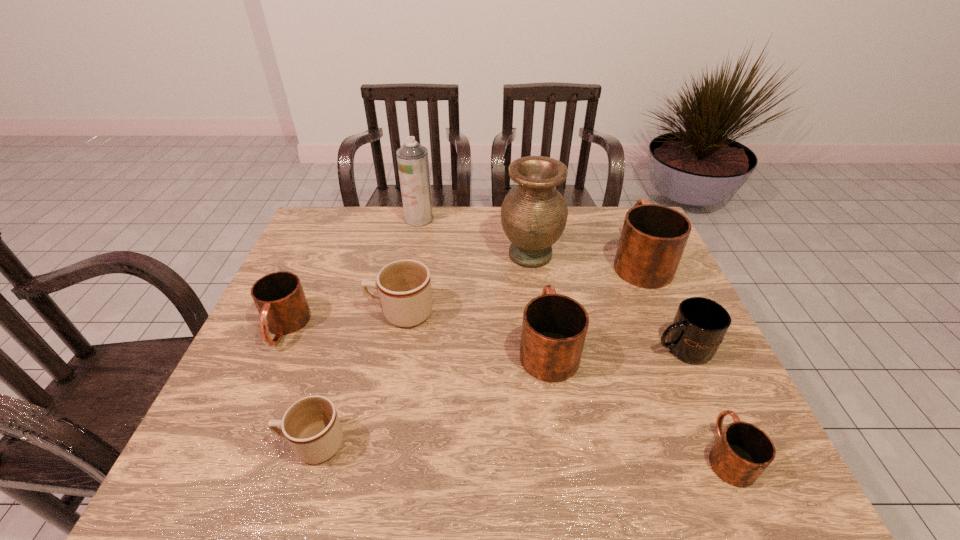
Find the location of a particular element. This screenshot has height=540, width=960. the farthest object is located at coordinates (412, 158).

Locate an element on the screen. This screenshot has height=540, width=960. vase is located at coordinates (533, 215).

Where is `the farthest rust mug`? This screenshot has height=540, width=960. the farthest rust mug is located at coordinates (653, 238).

Where is `the farthest mug`? This screenshot has height=540, width=960. the farthest mug is located at coordinates (653, 238).

Identify the location of the third rust mug from right to left. (554, 327).

Find the location of `the third smallest rust mug`. the third smallest rust mug is located at coordinates (554, 327).

Where is `the bigger brown mug`? the bigger brown mug is located at coordinates (404, 286).

You are a GUI agent. You are given a task and a screenshot of the screen. Output one action in this format:
    pyautogui.click(x=<x>, y=<y>)
    Task: Click on the black mug
    
    Given the screenshot: What is the action you would take?
    pyautogui.click(x=700, y=324)

You are a GUI agent. You are given a task and a screenshot of the screen. Output one action in this format:
    pyautogui.click(x=<x>, y=<y>)
    Task: Click on the third biggest rust mug
    This screenshot has width=960, height=540.
    Given the screenshot: What is the action you would take?
    pyautogui.click(x=279, y=297)

You are a GUI agent. You are given a task and a screenshot of the screen. Output one action in this format:
    pyautogui.click(x=<x>, y=<y>)
    Task: Click on the leftmost mug
    This screenshot has height=540, width=960.
    Given the screenshot: What is the action you would take?
    pyautogui.click(x=279, y=297)